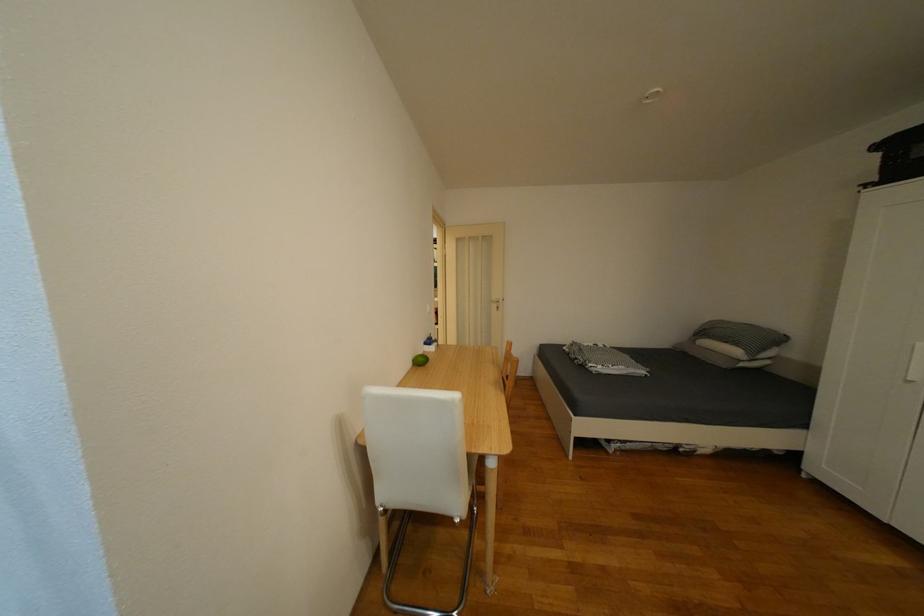
Where would you lift the grey pillow? Please return your answer as a coordinate pair (x, y).

(740, 339)